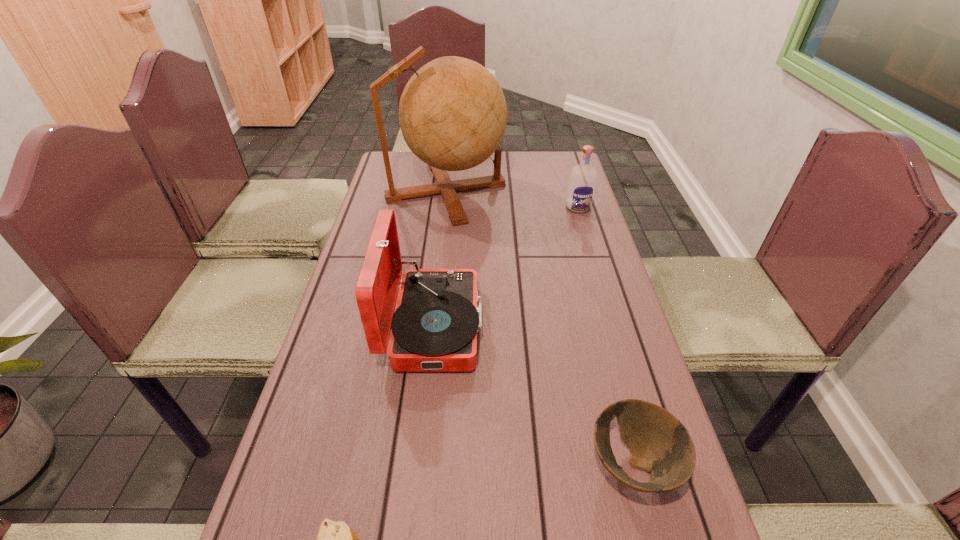
This screenshot has width=960, height=540. Find the location of `object at the far edge`. object at the far edge is located at coordinates (453, 114).

I want to click on globe located at the left edge, so click(453, 114).

The image size is (960, 540). I want to click on phonograph_record situated at the left edge, so click(x=434, y=328).

The image size is (960, 540). Identify the location of vodka at the right edge. (582, 181).

Identify the location of bowl situated at the right edge. Image resolution: width=960 pixels, height=540 pixels. (660, 444).

What are the coordinates of `object present at the far left corner` in the screenshot? It's located at (453, 114).

In the image, there is a desktop. What are the coordinates of `vacant space at the far edge` in the screenshot? It's located at (531, 166).

This screenshot has height=540, width=960. In the image, there is a desktop. Find the location of `free space at the left edge`. free space at the left edge is located at coordinates [x=366, y=252].

Locate an element on the screen. The image size is (960, 540). blank space at the right edge of the desktop is located at coordinates (590, 221).

The height and width of the screenshot is (540, 960). In the image, there is a desktop. What are the coordinates of `vacant space at the far left corner` in the screenshot? It's located at (422, 167).